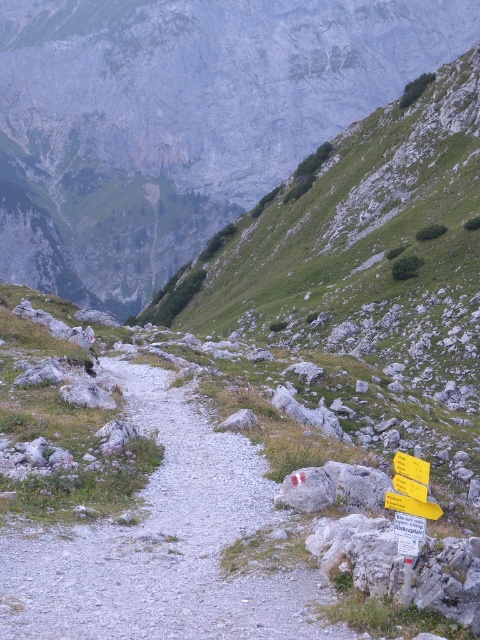
Who is positioned more to the right, green grassy mountain at center or yellow plastic sign at lower right?

yellow plastic sign at lower right

Consider the image. How far apart are green grassy mountain at center and yellow plastic sign at lower right?

The distance of green grassy mountain at center from yellow plastic sign at lower right is 406.06 meters.

Who is more forward, (262, 134) or (410, 502)?

Point (410, 502) is more forward.

The width and height of the screenshot is (480, 640). In order to click on green grassy mountain at center in this screenshot , I will do `click(180, 120)`.

Can you confirm if green grassy mountain at center is thinner than gray gravel path at center?

No, green grassy mountain at center is not thinner than gray gravel path at center.

Is green grassy mountain at center wider than gray gravel path at center?

Yes, green grassy mountain at center is wider than gray gravel path at center.

Describe the element at coordinates (180, 120) in the screenshot. I see `green grassy mountain at center` at that location.

The width and height of the screenshot is (480, 640). I want to click on green grassy mountain at center, so click(x=180, y=120).

What do you see at coordinates (163, 545) in the screenshot? I see `gray gravel path at center` at bounding box center [163, 545].

Can you confirm if gray gravel path at center is shorter than yellow plastic sign at lower right?

Incorrect, gray gravel path at center's height does not fall short of yellow plastic sign at lower right's.

The image size is (480, 640). What do you see at coordinates (163, 545) in the screenshot?
I see `gray gravel path at center` at bounding box center [163, 545].

I want to click on gray gravel path at center, so click(x=163, y=545).